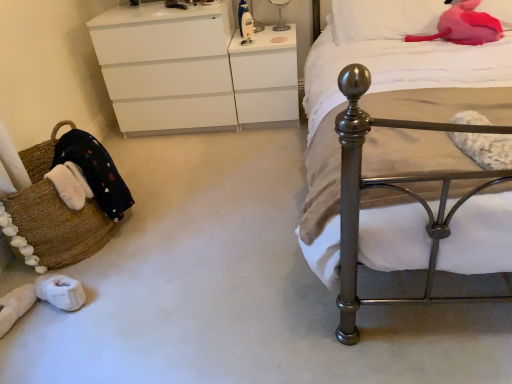
At what (x,y) coordinates should I click in order to perform the action: click on free space in front of brown woven basket at lower left. Please return your answer as a coordinate pair (x, y). Image resolution: width=512 pixels, height=384 pixels. Looking at the image, I should click on (98, 310).